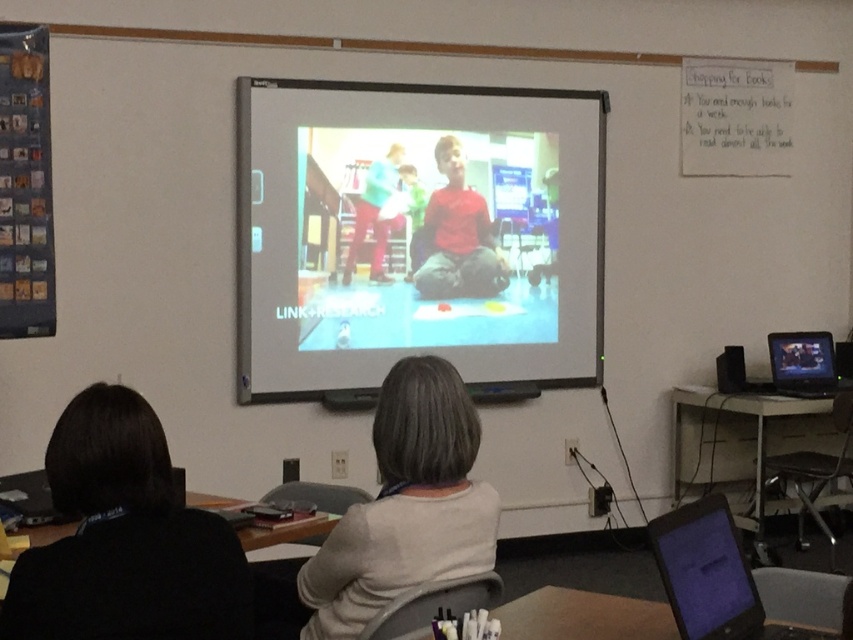
You are organizing a classroom storage area and need to decide where to place the white matte sweater at center and the black glossy laptop at lower right. Given their sizes, which item should you place in the smaller storage compartment?

The white matte sweater at center should be placed in the smaller storage compartment because it occupies less space than the black glossy laptop at lower right.

You are a student in the classroom and want to place a book on top of the white matte sweater at center and the black glossy laptop at right. Which object will allow the book to be more visible to someone sitting across the desk?

The white matte sweater at center has a greater height compared to the black glossy laptop at right, so placing the book on the white matte sweater at center will make it more visible to someone sitting across the desk.

You are a student sitting in the classroom and need to place a book on the desk. The book is as tall as the white matte sweater at center. Will it fit on the desk where the black glossy laptop at lower right is currently placed?

The white matte sweater at center has a greater height compared to the black glossy laptop at lower right. Since the book is as tall as the sweater, it may not fit on the desk space where the laptop is placed because the laptop is shorter, implying less vertical space.